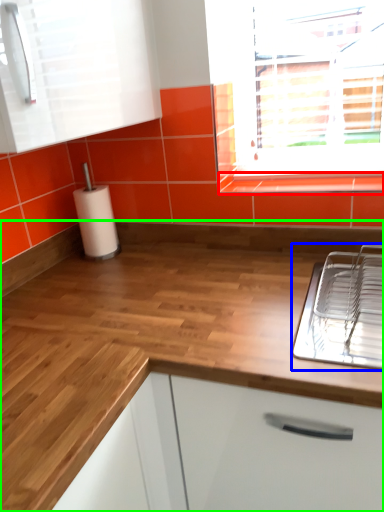
Question: Which object is the closest to the window sill (highlighted by a red box)? Choose among these: appliance (highlighted by a blue box) or countertop (highlighted by a green box).

Choices:
 (A) appliance
 (B) countertop

Answer: (A)